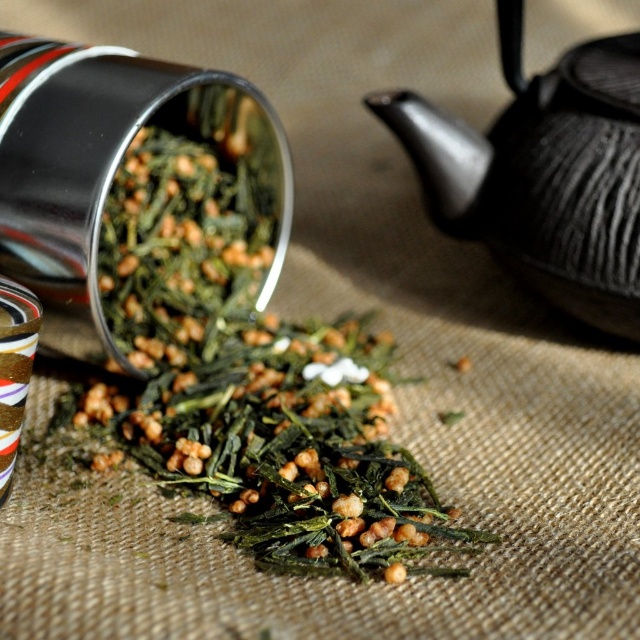
Question: Does green leafy with small seeds at center lie behind black textured teapot at upper right?

Choices:
 (A) no
 (B) yes

Answer: (A)

Question: Which point is farther to the camera?

Choices:
 (A) (588, 260)
 (B) (141, 436)

Answer: (A)

Question: Can you confirm if green leafy with small seeds at center is positioned to the right of black textured teapot at upper right?

Choices:
 (A) no
 (B) yes

Answer: (A)

Question: Is green leafy with small seeds at center to the right of black textured teapot at upper right from the viewer's perspective?

Choices:
 (A) no
 (B) yes

Answer: (A)